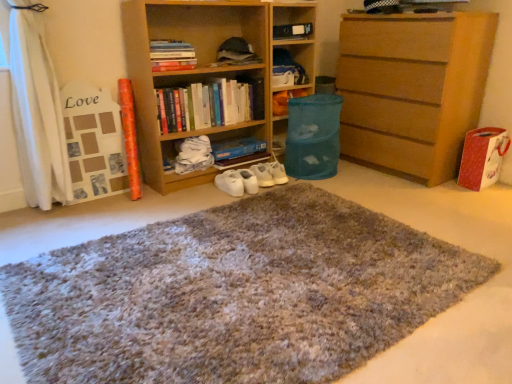
Question: Does wooden bookshelf at center have a smaller size compared to translucent plastic bin at center?

Choices:
 (A) no
 (B) yes

Answer: (A)

Question: Is wooden bookshelf at center at the right side of translucent plastic bin at center?

Choices:
 (A) no
 (B) yes

Answer: (A)

Question: From a real-world perspective, is wooden bookshelf at center positioned under translucent plastic bin at center based on gravity?

Choices:
 (A) yes
 (B) no

Answer: (B)

Question: Is wooden bookshelf at center oriented away from translucent plastic bin at center?

Choices:
 (A) yes
 (B) no

Answer: (B)

Question: Is wooden bookshelf at center shorter than translucent plastic bin at center?

Choices:
 (A) no
 (B) yes

Answer: (B)

Question: Is point (237, 117) positioned closer to the camera than point (467, 69)?

Choices:
 (A) farther
 (B) closer

Answer: (A)

Question: From a real-world perspective, is hardcover books at center, which is the first book from bottom to top, physically located above or below light brown wooden chest of drawers at right?

Choices:
 (A) below
 (B) above

Answer: (B)

Question: Is hardcover books at center, which is the first book from bottom to top, wider or thinner than light brown wooden chest of drawers at right?

Choices:
 (A) thin
 (B) wide

Answer: (A)

Question: From the image's perspective, is hardcover books at center, which is the second book from top to bottom, above or below light brown wooden chest of drawers at right?

Choices:
 (A) below
 (B) above

Answer: (A)

Question: Visually, is white matte sneakers at center positioned to the left or to the right of shaggy carpet at center?

Choices:
 (A) right
 (B) left

Answer: (B)

Question: From the image's perspective, is white matte sneakers at center located above or below shaggy carpet at center?

Choices:
 (A) below
 (B) above

Answer: (B)

Question: Considering the positions of white matte sneakers at center and shaggy carpet at center in the image, is white matte sneakers at center taller or shorter than shaggy carpet at center?

Choices:
 (A) short
 (B) tall

Answer: (B)

Question: Do you think white matte sneakers at center is within shaggy carpet at center, or outside of it?

Choices:
 (A) outside
 (B) inside

Answer: (A)

Question: From a real-world perspective, is shaggy carpet at center physically located above or below light brown wooden chest of drawers at right?

Choices:
 (A) above
 (B) below

Answer: (B)

Question: Considering the positions of point (28, 344) and point (445, 49), is point (28, 344) closer or farther from the camera than point (445, 49)?

Choices:
 (A) closer
 (B) farther

Answer: (A)